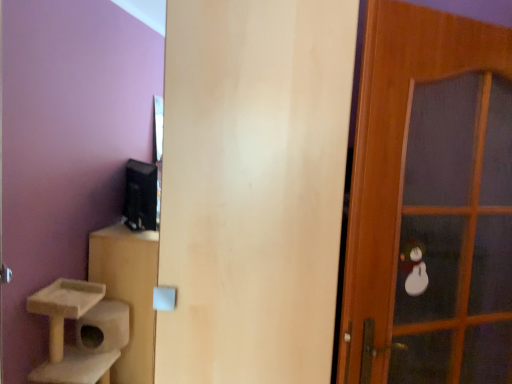
Question: Is matte wood door at center, which appears as the 2th door when viewed from the right, turned away from wooden door at right, which is counted as the first door, starting from the right?

Choices:
 (A) no
 (B) yes

Answer: (A)

Question: Is matte wood door at center, which appears as the 2th door when viewed from the right, wider than wooden door at right, which is counted as the first door, starting from the right?

Choices:
 (A) no
 (B) yes

Answer: (B)

Question: Could you tell me if matte wood door at center, which appears as the 2th door when viewed from the right, is facing wooden door at right, positioned as the 2th door in left-to-right order?

Choices:
 (A) yes
 (B) no

Answer: (B)

Question: Could wooden door at right, which is counted as the first door, starting from the right, be considered to be inside matte wood door at center, acting as the first door starting from the left?

Choices:
 (A) no
 (B) yes

Answer: (A)

Question: Is matte wood door at center, which appears as the 2th door when viewed from the right, thinner than wooden door at right, positioned as the 2th door in left-to-right order?

Choices:
 (A) no
 (B) yes

Answer: (A)

Question: Can you confirm if matte wood door at center, acting as the first door starting from the left, is positioned to the left of wooden door at right, positioned as the 2th door in left-to-right order?

Choices:
 (A) no
 (B) yes

Answer: (B)

Question: Is wooden door at right, positioned as the 2th door in left-to-right order, in contact with matte wood door at center, which appears as the 2th door when viewed from the right?

Choices:
 (A) yes
 (B) no

Answer: (B)

Question: Is wooden door at right, which is counted as the first door, starting from the right, thinner than matte wood door at center, acting as the first door starting from the left?

Choices:
 (A) no
 (B) yes

Answer: (B)

Question: Is wooden door at right, positioned as the 2th door in left-to-right order, closer to camera compared to matte wood door at center, acting as the first door starting from the left?

Choices:
 (A) no
 (B) yes

Answer: (A)

Question: Is wooden door at right, positioned as the 2th door in left-to-right order, turned away from matte wood door at center, acting as the first door starting from the left?

Choices:
 (A) yes
 (B) no

Answer: (B)

Question: Can you confirm if wooden door at right, which is counted as the first door, starting from the right, is wider than matte wood door at center, acting as the first door starting from the left?

Choices:
 (A) no
 (B) yes

Answer: (A)

Question: Is matte wood door at center, which appears as the 2th door when viewed from the right, inside wooden door at right, positioned as the 2th door in left-to-right order?

Choices:
 (A) no
 (B) yes

Answer: (A)

Question: Which is correct: matte wood door at center, acting as the first door starting from the left, is inside wooden door at right, which is counted as the first door, starting from the right, or outside of it?

Choices:
 (A) outside
 (B) inside

Answer: (A)